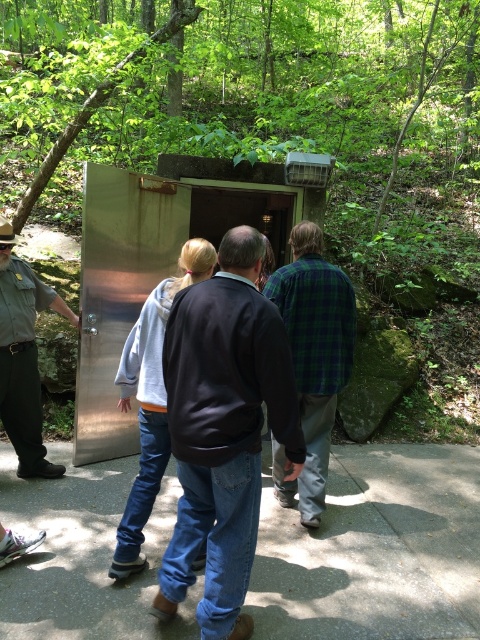
Question: Is the position of concrete pavement at center more distant than that of brushed metal uniform at left?

Choices:
 (A) no
 (B) yes

Answer: (A)

Question: Is concrete pavement at center to the left of dark blue sweater at center from the viewer's perspective?

Choices:
 (A) no
 (B) yes

Answer: (A)

Question: Which point is farther to the camera?

Choices:
 (A) (442, 620)
 (B) (4, 268)
 (C) (244, 396)
 (D) (325, 352)

Answer: (B)

Question: Which point is closer to the camera?

Choices:
 (A) green plaid shirt at center
 (B) concrete pavement at center
 (C) dark blue sweater at center

Answer: (C)

Question: Which object appears closest to the camera in this image?

Choices:
 (A) brushed metal uniform at left
 (B) dark blue sweater at center
 (C) green plaid shirt at center

Answer: (B)

Question: Is dark blue sweater at center wider than brushed metal uniform at left?

Choices:
 (A) no
 (B) yes

Answer: (B)